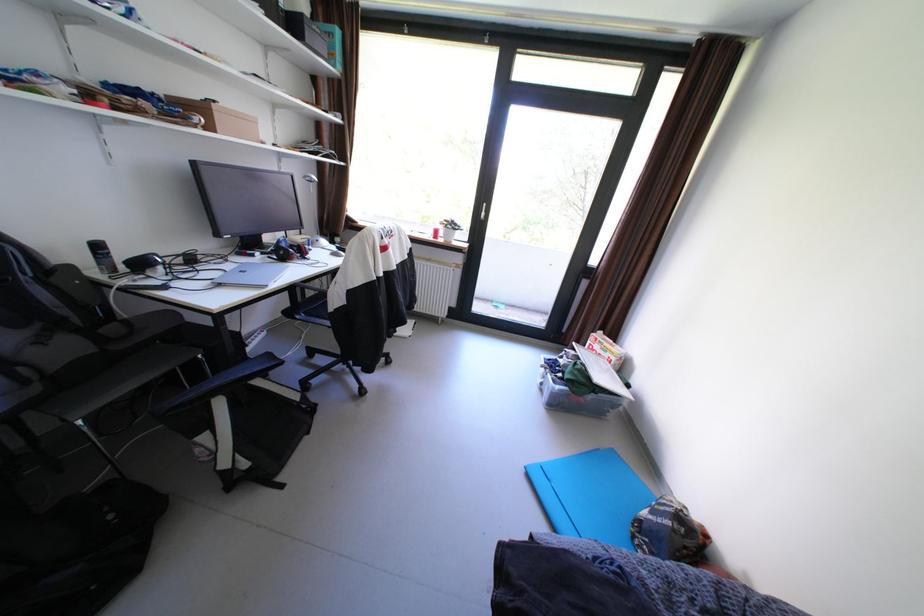
Identify the location of plastic storage bin. This screenshot has height=616, width=924. (578, 386).